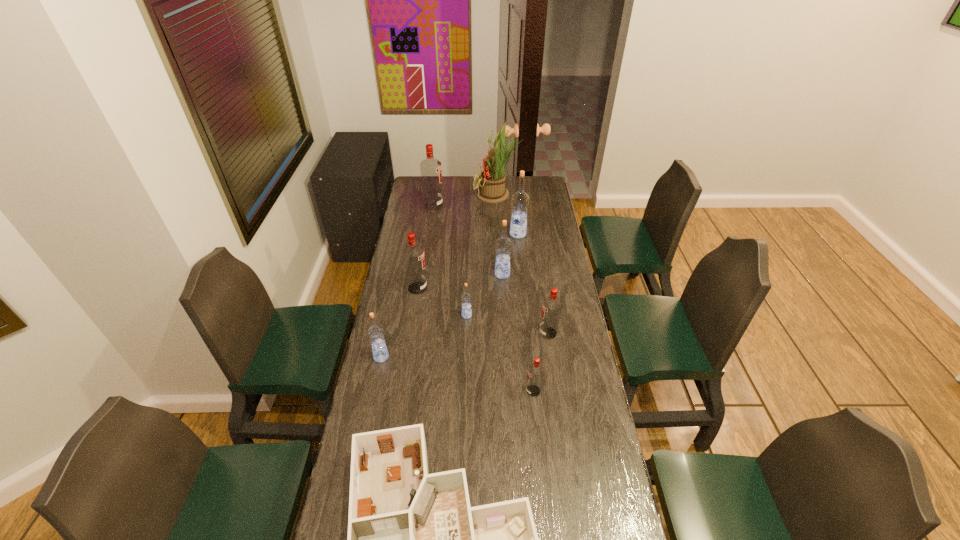
At what (x,y) coordinates should I click in order to perform the action: click on vacant space situated 0.270m on the front label of the nearest vodka. Please return your answer as a coordinate pair (x, y). The width and height of the screenshot is (960, 540). Looking at the image, I should click on (450, 391).

Where is `free spot located on the right of the fourth nearest vodka`? This screenshot has width=960, height=540. free spot located on the right of the fourth nearest vodka is located at coordinates (503, 315).

You are a GUI agent. You are given a task and a screenshot of the screen. Output one action in this format:
    pyautogui.click(x=<x>, y=<y>)
    Task: Click on the object that is positioned at the far edge
    This screenshot has height=540, width=960.
    Given the screenshot: What is the action you would take?
    pyautogui.click(x=492, y=189)

Find the location of a particular element. This screenshot has height=540, width=960. object situated at the right edge is located at coordinates (551, 306).

You are a GUI agent. You are given a task and a screenshot of the screen. Output one action in this format:
    pyautogui.click(x=<x>, y=<y>)
    Task: Click on the vacant space at the far edge
    This screenshot has height=540, width=960.
    Given the screenshot: What is the action you would take?
    pyautogui.click(x=469, y=195)

Image resolution: width=960 pixels, height=540 pixels. In order to click on vacant space at the left edge of the desktop in this screenshot , I will do `click(399, 342)`.

In the image, there is a desktop. What are the coordinates of `vacant space at the right edge` in the screenshot? It's located at (580, 334).

I want to click on vacant area between the rightmost red vodka and the nearest vodka, so click(x=540, y=362).

Locate an element on the screen. This screenshot has width=960, height=540. free space that is in between the sixth nearest object and the second smallest red vodka is located at coordinates (483, 310).

Where is `free area in between the farthest red vodka and the sixth farthest vodka`? Image resolution: width=960 pixels, height=540 pixels. free area in between the farthest red vodka and the sixth farthest vodka is located at coordinates (491, 269).